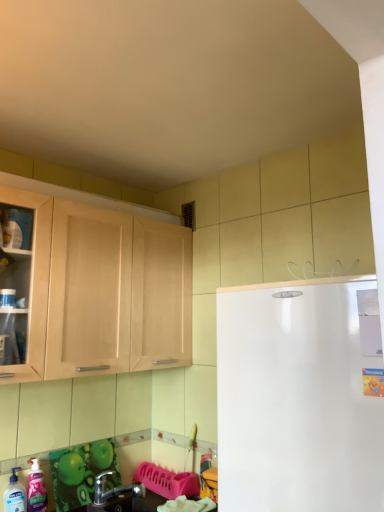
In order to click on pink glossy liquid soap at lower left, placed as the 1th cleaning product when sorted from right to left in this screenshot , I will do `click(36, 489)`.

Find the location of a particular element. pink glossy liquid soap at lower left, positioned as the 2th cleaning product in left-to-right order is located at coordinates (36, 489).

Consider the image. Which of these two, white smooth refrigerator at right or light wood cabinet at left, is smaller?

Smaller between the two is light wood cabinet at left.

In order to click on refrigerator below the light wood cabinet at left (from the image's perspective) in this screenshot , I will do `click(296, 399)`.

Which is more to the right, white smooth refrigerator at right or light wood cabinet at left?

white smooth refrigerator at right.

Is white smooth refrigerator at right oriented away from light wood cabinet at left?

white smooth refrigerator at right does not have its back to light wood cabinet at left.

Which is behind, pink glossy liquid soap at lower left, placed as the 1th cleaning product when sorted from right to left, or light wood cabinet at left?

pink glossy liquid soap at lower left, placed as the 1th cleaning product when sorted from right to left, is further away from the camera.

Could you tell me if pink glossy liquid soap at lower left, placed as the 1th cleaning product when sorted from right to left, is turned towards light wood cabinet at left?

No, pink glossy liquid soap at lower left, placed as the 1th cleaning product when sorted from right to left, is not turned towards light wood cabinet at left.

Which is in front, point (34, 482) or point (179, 283)?

The point (34, 482) is more forward.

Are translucent plastic soap dispenser at lower left, positioned as the first cleaning product in left-to-right order, and green glossy countertop at lower left far apart?

No, translucent plastic soap dispenser at lower left, positioned as the first cleaning product in left-to-right order, is not far from green glossy countertop at lower left.

Does translucent plastic soap dispenser at lower left, which is the second cleaning product in right-to-left order, turn towards green glossy countertop at lower left?

No, translucent plastic soap dispenser at lower left, which is the second cleaning product in right-to-left order, does not turn towards green glossy countertop at lower left.

From a real-world perspective, who is located lower, translucent plastic soap dispenser at lower left, positioned as the first cleaning product in left-to-right order, or green glossy countertop at lower left?

green glossy countertop at lower left, from a real-world perspective.

From a real-world perspective, is translucent plastic soap dispenser at lower left, which is the second cleaning product in right-to-left order, positioned above or below light wood cabinet at left?

In terms of real-world spatial position, translucent plastic soap dispenser at lower left, which is the second cleaning product in right-to-left order, is below light wood cabinet at left.

Which object is wider, translucent plastic soap dispenser at lower left, positioned as the first cleaning product in left-to-right order, or light wood cabinet at left?

Wider between the two is light wood cabinet at left.

Is point (16, 505) farther from viewer compared to point (164, 353)?

No, it is not.

Considering the positions of point (105, 507) and point (57, 249), is point (105, 507) closer or farther from the camera than point (57, 249)?

Point (105, 507).

Looking at this image, in the image, is green glossy countertop at lower left on the left side or the right side of light wood cabinet at left?

green glossy countertop at lower left is to the right of light wood cabinet at left.

Find the location of a particular element. Image resolution: width=384 pixels, height=512 pixels. counter top behind the light wood cabinet at left is located at coordinates (127, 503).

Is green glossy countertop at lower left spatially inside light wood cabinet at left, or outside of it?

green glossy countertop at lower left is not enclosed by light wood cabinet at left.

Is translucent plastic soap dispenser at lower left, positioned as the first cleaning product in left-to-right order, surrounded by metallic silver faucet at lower left?

No, translucent plastic soap dispenser at lower left, positioned as the first cleaning product in left-to-right order, is not inside metallic silver faucet at lower left.

From the image's perspective, starting from the metallic silver faucet at lower left, which cleaning product is the 1st one above? Please provide its 2D coordinates.

[(15, 494)]

Is metallic silver faucet at lower left positioned with its back to translucent plastic soap dispenser at lower left, positioned as the first cleaning product in left-to-right order?

No, translucent plastic soap dispenser at lower left, positioned as the first cleaning product in left-to-right order, is not at the back of metallic silver faucet at lower left.

Which is behind, metallic silver faucet at lower left or translucent plastic soap dispenser at lower left, positioned as the first cleaning product in left-to-right order?

Positioned behind is metallic silver faucet at lower left.

Which of these two, translucent plastic soap dispenser at lower left, positioned as the first cleaning product in left-to-right order, or pink glossy liquid soap at lower left, positioned as the 2th cleaning product in left-to-right order, is smaller?

pink glossy liquid soap at lower left, positioned as the 2th cleaning product in left-to-right order.

From a real-world perspective, is translucent plastic soap dispenser at lower left, positioned as the first cleaning product in left-to-right order, positioned above or below pink glossy liquid soap at lower left, placed as the 1th cleaning product when sorted from right to left?

In terms of real-world spatial position, translucent plastic soap dispenser at lower left, positioned as the first cleaning product in left-to-right order, is below pink glossy liquid soap at lower left, placed as the 1th cleaning product when sorted from right to left.

Is translucent plastic soap dispenser at lower left, positioned as the first cleaning product in left-to-right order, next to pink glossy liquid soap at lower left, placed as the 1th cleaning product when sorted from right to left, and touching it?

Yes.

Is translucent plastic soap dispenser at lower left, positioned as the first cleaning product in left-to-right order, not within pink glossy liquid soap at lower left, positioned as the 2th cleaning product in left-to-right order?

That's correct, translucent plastic soap dispenser at lower left, positioned as the first cleaning product in left-to-right order, is outside of pink glossy liquid soap at lower left, positioned as the 2th cleaning product in left-to-right order.

Find the location of `cabinetry above the white smooth refrigerator at right (from a real-world perspective)`. cabinetry above the white smooth refrigerator at right (from a real-world perspective) is located at coordinates (112, 287).

Locate an element on the screen. the 1st cleaning product below when counting from the light wood cabinet at left (from the image's perspective) is located at coordinates (36, 489).

Which object lies further to the anchor point light wood cabinet at left, translucent plastic soap dispenser at lower left, which is the second cleaning product in right-to-left order, or white smooth refrigerator at right?

The object further to light wood cabinet at left is translucent plastic soap dispenser at lower left, which is the second cleaning product in right-to-left order.

Estimate the real-world distances between objects in this image. Which object is further from green glossy countertop at lower left, metallic silver faucet at lower left or translucent plastic soap dispenser at lower left, positioned as the first cleaning product in left-to-right order?

translucent plastic soap dispenser at lower left, positioned as the first cleaning product in left-to-right order, is further to green glossy countertop at lower left.

Estimate the real-world distances between objects in this image. Which object is closer to pink glossy liquid soap at lower left, positioned as the 2th cleaning product in left-to-right order, light wood cabinet at left or white smooth refrigerator at right?

Among the two, light wood cabinet at left is located nearer to pink glossy liquid soap at lower left, positioned as the 2th cleaning product in left-to-right order.

Looking at the image, which one is located closer to metallic silver faucet at lower left, light wood cabinet at left or green glossy countertop at lower left?

green glossy countertop at lower left is positioned closer to the anchor metallic silver faucet at lower left.

From the image, which object appears to be farther from pink glossy liquid soap at lower left, placed as the 1th cleaning product when sorted from right to left, translucent plastic soap dispenser at lower left, which is the second cleaning product in right-to-left order, or metallic silver faucet at lower left?

metallic silver faucet at lower left is further to pink glossy liquid soap at lower left, placed as the 1th cleaning product when sorted from right to left.

When comparing their distances from white smooth refrigerator at right, does translucent plastic soap dispenser at lower left, which is the second cleaning product in right-to-left order, or green glossy countertop at lower left seem closer?

green glossy countertop at lower left is closer to white smooth refrigerator at right.

Based on their spatial positions, is pink glossy liquid soap at lower left, placed as the 1th cleaning product when sorted from right to left, or green glossy countertop at lower left closer to translucent plastic soap dispenser at lower left, positioned as the first cleaning product in left-to-right order?

pink glossy liquid soap at lower left, placed as the 1th cleaning product when sorted from right to left.

Considering their positions, is metallic silver faucet at lower left positioned closer to green glossy countertop at lower left than pink glossy liquid soap at lower left, placed as the 1th cleaning product when sorted from right to left?

Among the two, metallic silver faucet at lower left is located nearer to green glossy countertop at lower left.

This screenshot has width=384, height=512. Find the location of `sink between translucent plastic soap dispenser at lower left, which is the second cleaning product in right-to-left order, and white smooth refrigerator at right from left to right`. sink between translucent plastic soap dispenser at lower left, which is the second cleaning product in right-to-left order, and white smooth refrigerator at right from left to right is located at coordinates (113, 495).

Locate an element on the screen. cleaning product that lies between light wood cabinet at left and translucent plastic soap dispenser at lower left, positioned as the first cleaning product in left-to-right order, from top to bottom is located at coordinates (36, 489).

Where is `sink between light wood cabinet at left and green glossy countertop at lower left from top to bottom`? The image size is (384, 512). sink between light wood cabinet at left and green glossy countertop at lower left from top to bottom is located at coordinates (113, 495).

Identify the location of refrigerator that lies between light wood cabinet at left and green glossy countertop at lower left from top to bottom. This screenshot has height=512, width=384. (296, 399).